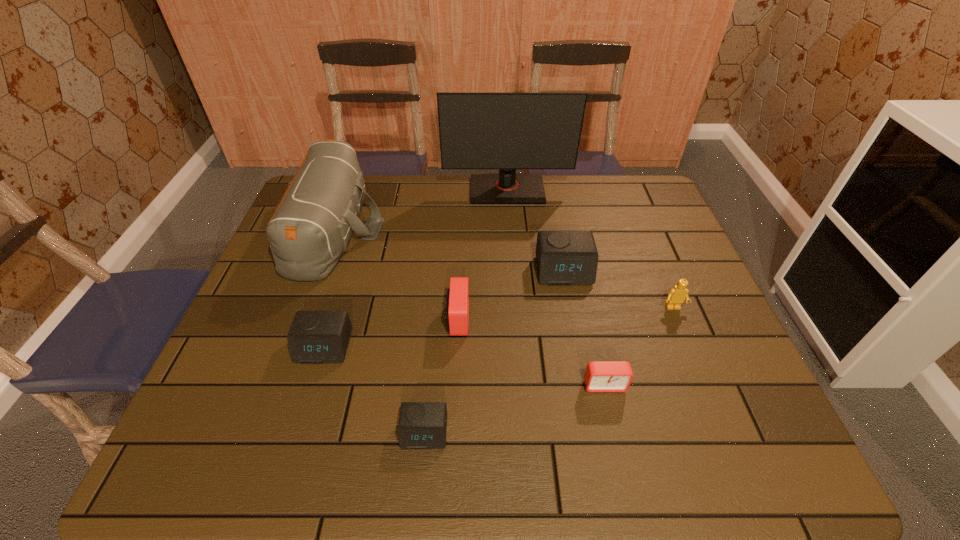
Image resolution: width=960 pixels, height=540 pixels. I want to click on free space between the rightmost object and the leftmost alarm clock, so click(x=498, y=328).

This screenshot has width=960, height=540. I want to click on vacant region between the left red alarm clock and the tallest object, so click(482, 254).

The height and width of the screenshot is (540, 960). Identify the location of object identified as the fifth closest to the smaller red alarm clock. (315, 337).

Locate an element on the screen. The height and width of the screenshot is (540, 960). object that can be found as the seventh closest to the second tallest object is located at coordinates click(x=676, y=296).

Where is `the closest alarm clock to the duffel bag`? This screenshot has width=960, height=540. the closest alarm clock to the duffel bag is located at coordinates (315, 337).

Identify which alarm clock is located as the nearest to the tallest object. Please provide its 2D coordinates. Your answer should be formatted as a tuple, i.e. [(x, y)], where the tuple contains the x and y coordinates of a point satisfying the conditions above.

[(563, 257)]

What are the coordinates of `the third closest black alarm clock to the right red alarm clock` in the screenshot? It's located at (315, 337).

Where is `the closest black alarm clock to the smaller red alarm clock`? the closest black alarm clock to the smaller red alarm clock is located at coordinates (563, 257).